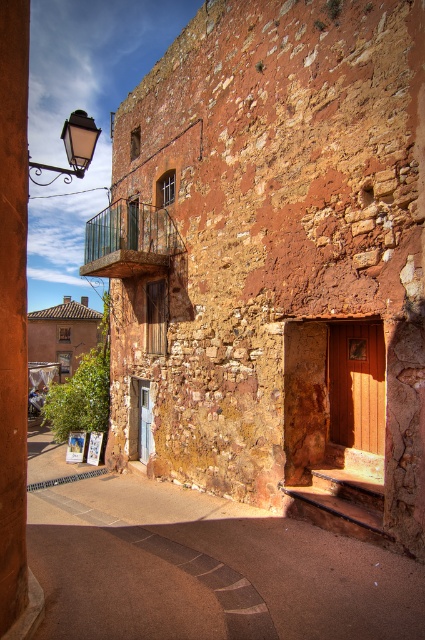
You are standing in front of the rustic stone building and want to take a photo of both the green glass balcony at upper left and the matte black streetlamp at upper left. Which object should you focus on first to ensure both are in the frame?

You should focus on the green glass balcony at upper left first because it is closer to you than the matte black streetlamp at upper left, ensuring both are in the frame.

You are a delivery person standing at the entrance of the rustic stone building. You need to deliver a package to the brown concrete alley at center and then to the matte black streetlamp at upper left. Given that your delivery cart can only move in straight lines and you have to return to the building entrance after both deliveries, what is the shortest possible path you can take?

The shortest path would involve going directly from the entrance to the brown concrete alley at center, then directly to the matte black streetlamp at upper left, and finally back to the entrance, forming a triangle. Since the distance between the alley and the streetlamp is 56.32 feet, the total path length depends on the specific distances from the entrance to each point, but the most efficient route minimizes unnecessary detours.

You are standing in front of the rustic stone building and notice two points marked on the facade. The first point is at coordinates point (91, 260) and the second at point (93, 138). Which of these points is closer to you?

Point (93, 138) is closer to you because it is in front of point (91, 260).